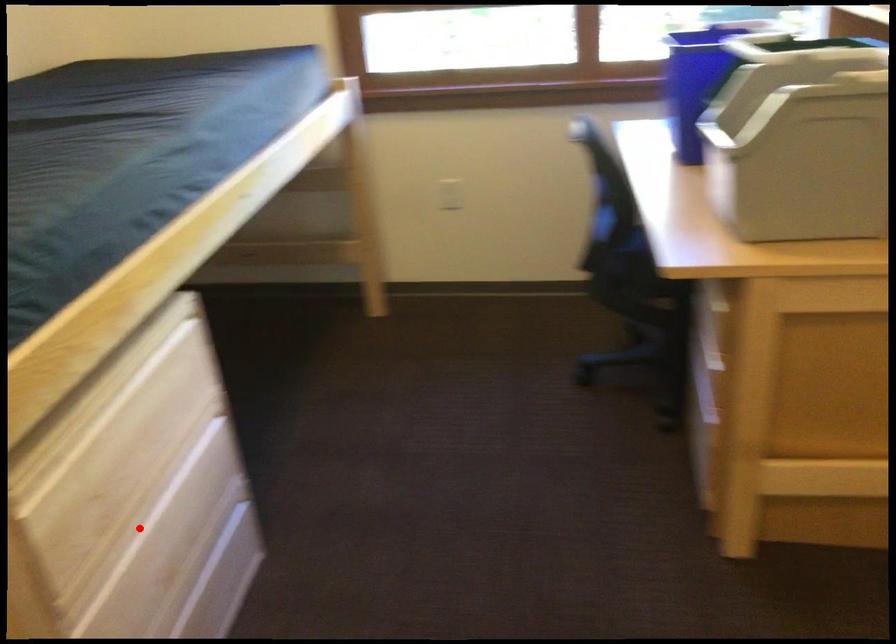
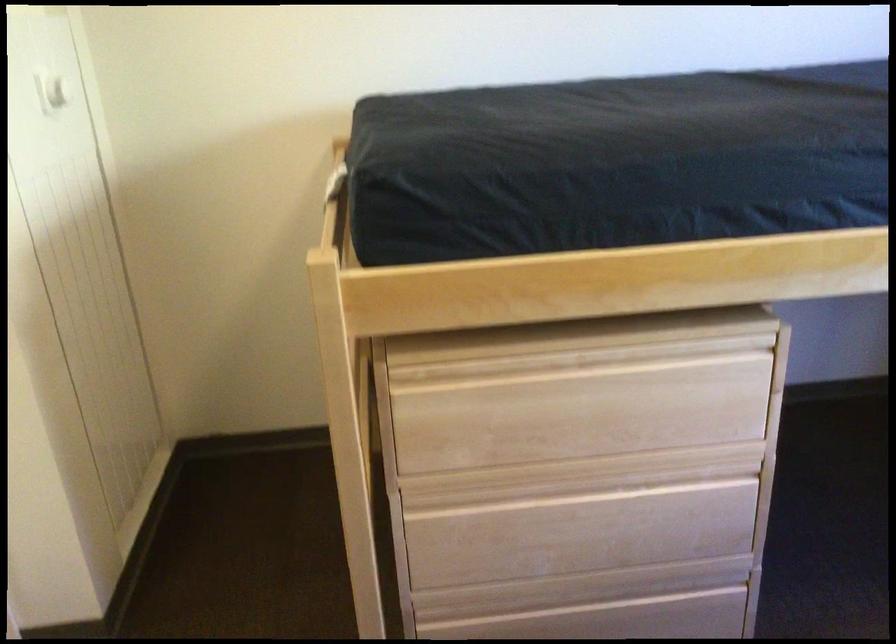
The point at the highlighted location is marked in the first image. Where is the corresponding point in the second image?

(546, 491)